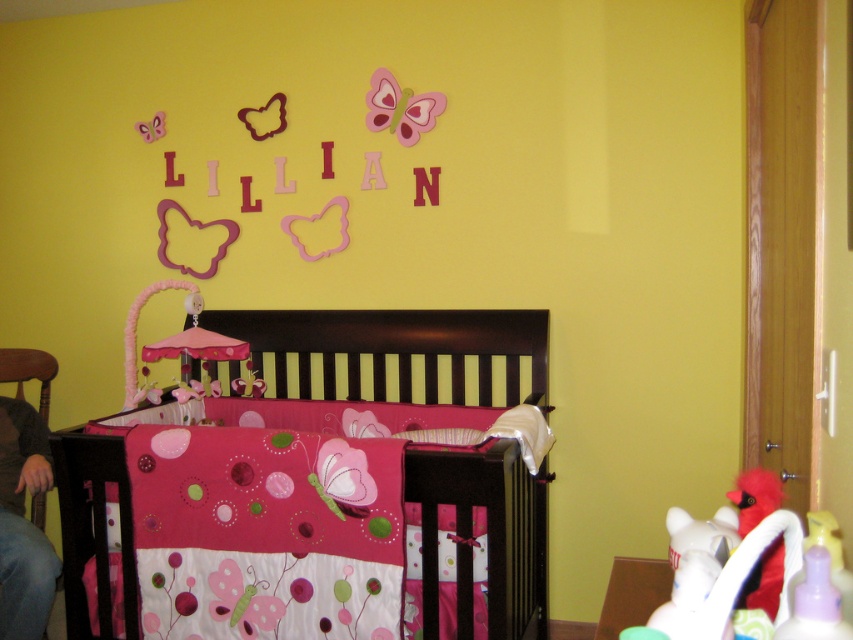
Is jeans at lower left smaller than green plastic changing table at lower right?

Actually, jeans at lower left might be larger than green plastic changing table at lower right.

Is jeans at lower left above green plastic changing table at lower right?

No, jeans at lower left is not above green plastic changing table at lower right.

The image size is (853, 640). Describe the element at coordinates (22, 524) in the screenshot. I see `jeans at lower left` at that location.

You are a GUI agent. You are given a task and a screenshot of the screen. Output one action in this format:
    pyautogui.click(x=<x>, y=<y>)
    Task: Click on the jeans at lower left
    This screenshot has height=640, width=853.
    Given the screenshot: What is the action you would take?
    pyautogui.click(x=22, y=524)

Is pink fabric crib at center to the left of brown wooden chair at left from the viewer's perspective?

No, pink fabric crib at center is not to the left of brown wooden chair at left.

Does pink fabric crib at center have a larger size compared to brown wooden chair at left?

Correct, pink fabric crib at center is larger in size than brown wooden chair at left.

This screenshot has width=853, height=640. I want to click on pink fabric crib at center, so click(396, 342).

Identify the location of pink fabric crib at center. The height and width of the screenshot is (640, 853). (396, 342).

Can you confirm if pink fabric crib at center is shorter than green plastic changing table at lower right?

No, pink fabric crib at center is not shorter than green plastic changing table at lower right.

Does point (465, 483) come closer to viewer compared to point (608, 628)?

No, (465, 483) is behind (608, 628).

You are a GUI agent. You are given a task and a screenshot of the screen. Output one action in this format:
    pyautogui.click(x=<x>, y=<y>)
    Task: Click on the pink fabric crib at center
    The width and height of the screenshot is (853, 640).
    Given the screenshot: What is the action you would take?
    [x=396, y=342]